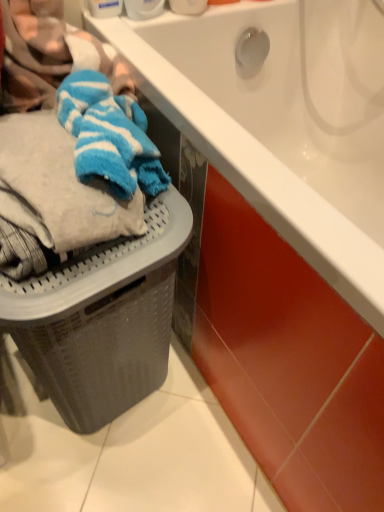
Question: From a real-world perspective, is gray textured laundry basket at lower left positioned above or below white plastic container at upper center, the 1th toiletry when ordered from left to right?

Choices:
 (A) below
 (B) above

Answer: (A)

Question: Does point (77, 338) appear closer or farther from the camera than point (158, 2)?

Choices:
 (A) farther
 (B) closer

Answer: (B)

Question: Which object is the farthest from the gray textured laundry basket at lower left?

Choices:
 (A) blue striped towel at left
 (B) white glossy bathtub at upper center
 (C) white plastic container at upper center, arranged as the 2th toiletry when viewed from the right
 (D) white plastic container at upper center, which ranks as the 1th toiletry in right-to-left order

Answer: (D)

Question: Which object is positioned farthest from the white glossy bathtub at upper center?

Choices:
 (A) white plastic container at upper center, which is counted as the 2th toiletry, starting from the left
 (B) blue striped towel at left
 (C) white plastic container at upper center, arranged as the 2th toiletry when viewed from the right
 (D) gray textured laundry basket at lower left

Answer: (D)